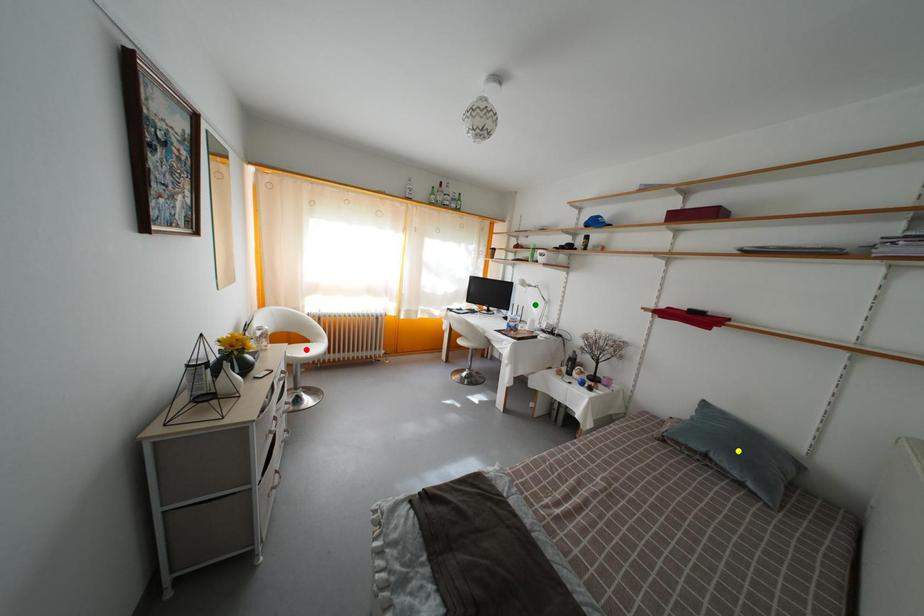
Order these from farthest to nearest:
red point | green point | yellow point

green point, red point, yellow point